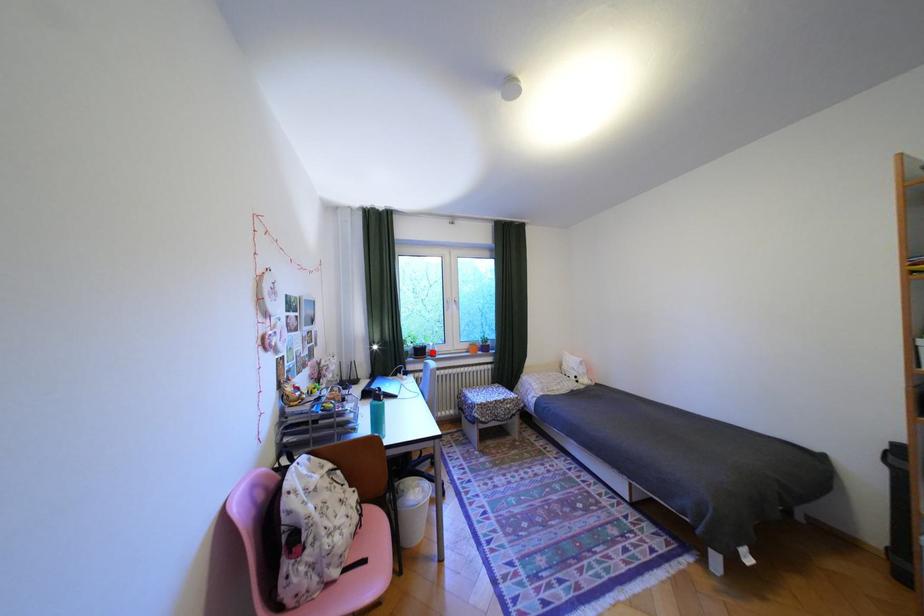
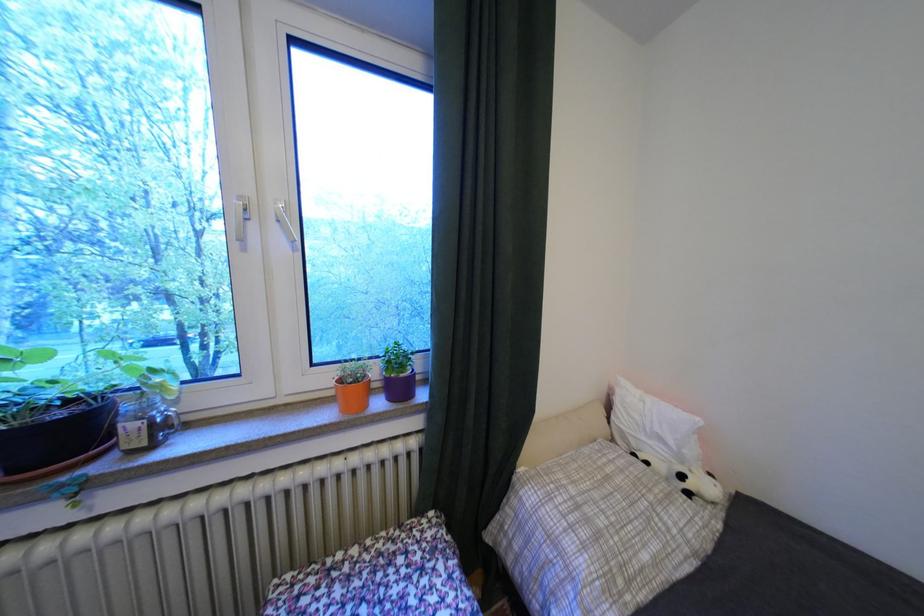
Question: A red point is marked in image1. In image2, is the corresponding 3D point closer to the camera or farther? Reply with the corresponding letter.

Choices:
 (A) The corresponding 3D point is closer.
 (B) The corresponding 3D point is farther.

Answer: (A)